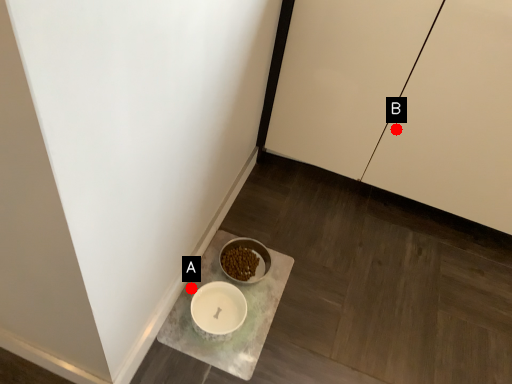
Question: Two points are circled on the image, labeled by A and B beside each circle. Which point is further to the camera?

Choices:
 (A) A is further
 (B) B is further

Answer: (B)